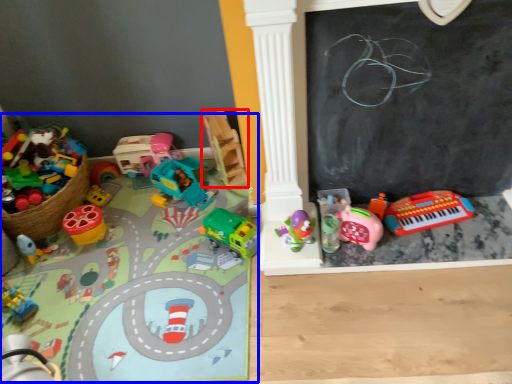
Question: Which point is closer to the camera, toy (highlighted by a red box) or toy (highlighted by a blue box)?

Choices:
 (A) toy
 (B) toy

Answer: (B)